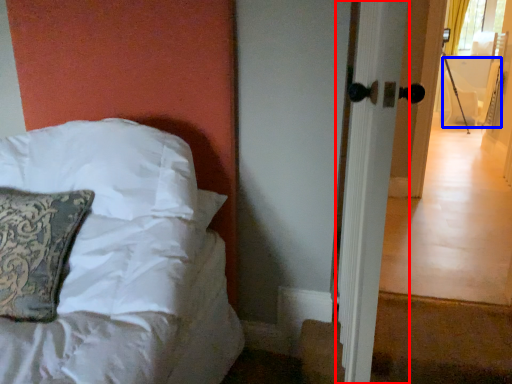
Question: Which point is closer to the camera, screen door (highlighted by a red box) or armchair (highlighted by a blue box)?

Choices:
 (A) screen door
 (B) armchair

Answer: (A)